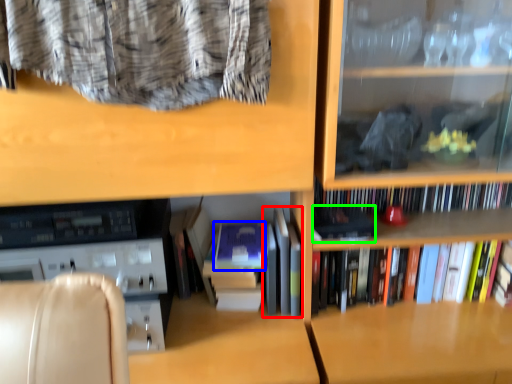
Question: Which object is positioned closest to book (highlighted by a red box)? Select from paperback book (highlighted by a blue box) and paperback book (highlighted by a green box).

Choices:
 (A) paperback book
 (B) paperback book

Answer: (A)